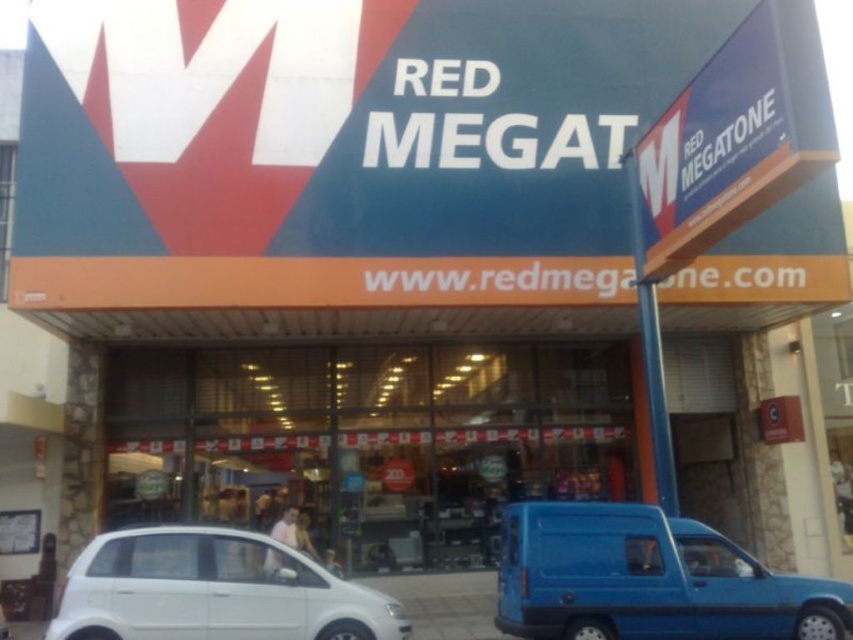
Question: Among these objects, which one is farthest from the camera?

Choices:
 (A) white matte hatchback at lower left
 (B) blue matte van at lower right

Answer: (B)

Question: Considering the relative positions of blue matte van at lower right and white matte hatchback at lower left in the image provided, where is blue matte van at lower right located with respect to white matte hatchback at lower left?

Choices:
 (A) left
 (B) right

Answer: (B)

Question: Among these points, which one is farthest from the camera?

Choices:
 (A) (120, 627)
 (B) (521, 592)

Answer: (B)

Question: Can you confirm if blue matte van at lower right is positioned below white matte hatchback at lower left?

Choices:
 (A) yes
 (B) no

Answer: (A)

Question: Does blue matte van at lower right have a greater width compared to white matte hatchback at lower left?

Choices:
 (A) no
 (B) yes

Answer: (B)